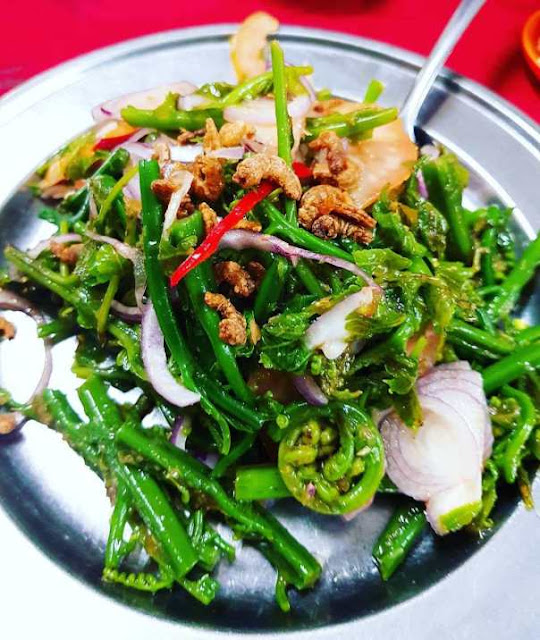
Identify the location of bowl. This screenshot has height=640, width=540. (54, 576).